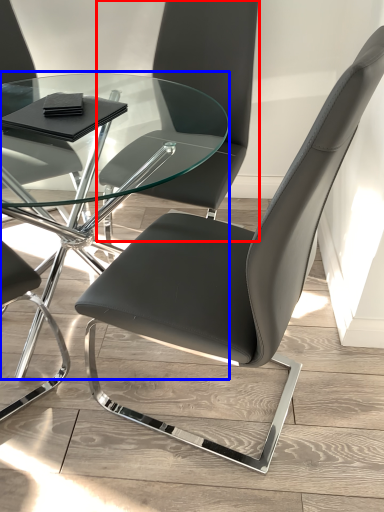
Question: Which of the following is the farthest to the observer, chair (highlighted by a red box) or table (highlighted by a blue box)?

Choices:
 (A) chair
 (B) table

Answer: (A)